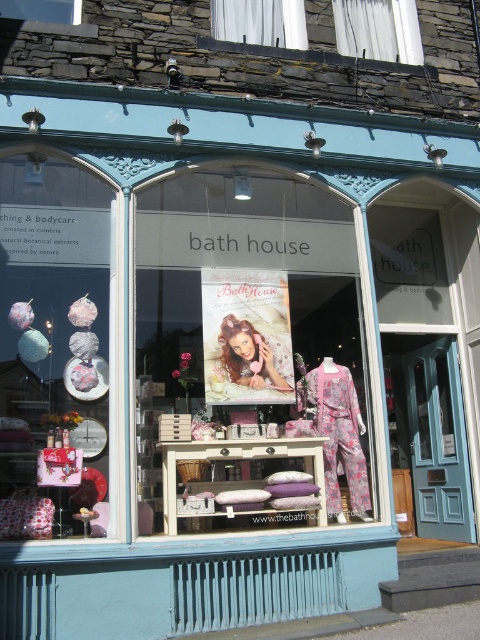
Does matte fabric hats at left have a smaller size compared to blonde hair at center?

No.

From the picture: Is matte fabric hats at left above blonde hair at center?

Indeed, matte fabric hats at left is positioned over blonde hair at center.

The image size is (480, 640). In order to click on matte fabric hats at left in this screenshot , I will do `click(54, 348)`.

I want to click on matte fabric hats at left, so click(54, 348).

How much distance is there between floral fabric dress at center and matte fabric hats at left?

A distance of 1.20 meters exists between floral fabric dress at center and matte fabric hats at left.

I want to click on floral fabric dress at center, so click(247, 355).

Measure the distance between matte fabric hats at left and white fabric at upper center.

matte fabric hats at left is 4.39 meters away from white fabric at upper center.

Which is below, matte fabric hats at left or white fabric at upper center?

matte fabric hats at left is below.

Is point (15, 236) more distant than point (336, 49)?

That is False.

Locate an element on the screen. This screenshot has width=480, height=640. matte fabric hats at left is located at coordinates (54, 348).